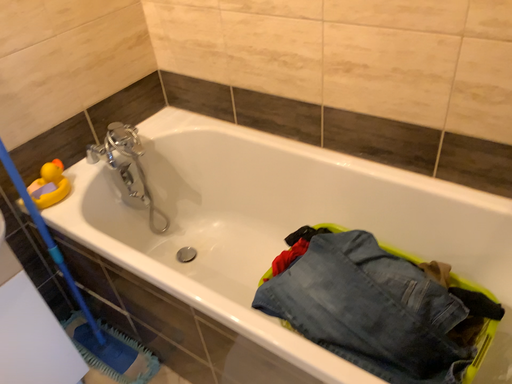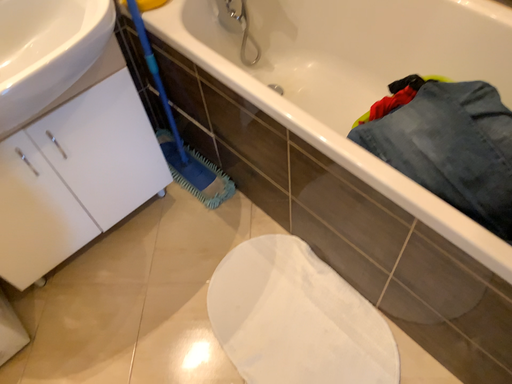
Question: Which way did the camera rotate in the video?

Choices:
 (A) rotated left
 (B) rotated right

Answer: (A)